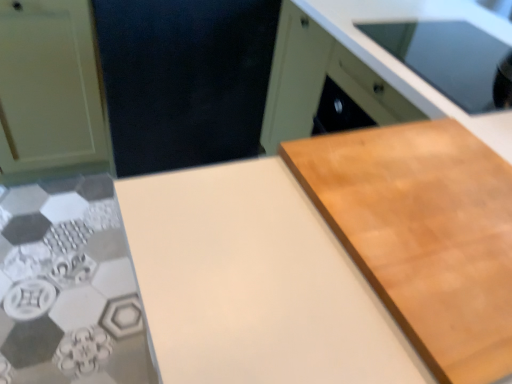
Find the location of `vacant space positioned to the left of light brown wood cutting board at right`. vacant space positioned to the left of light brown wood cutting board at right is located at coordinates (243, 248).